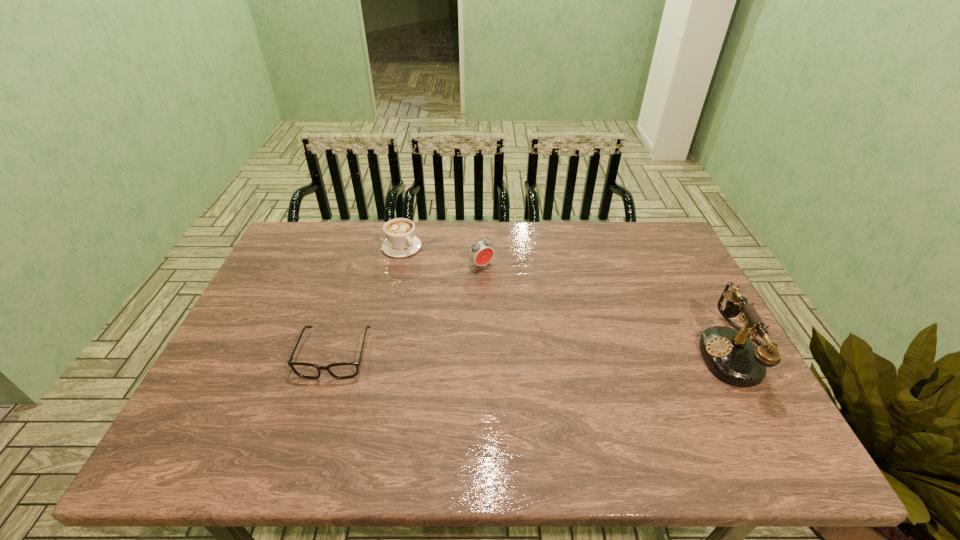
The image size is (960, 540). Identify the location of free space on the desktop that is between the shortest object and the telephone and is positioned on the face of the third shortest object. (566, 354).

This screenshot has width=960, height=540. I want to click on vacant space on the desktop that is between the spectacles and the rightmost object and is positioned to the right of the farthest object's handle, so click(537, 354).